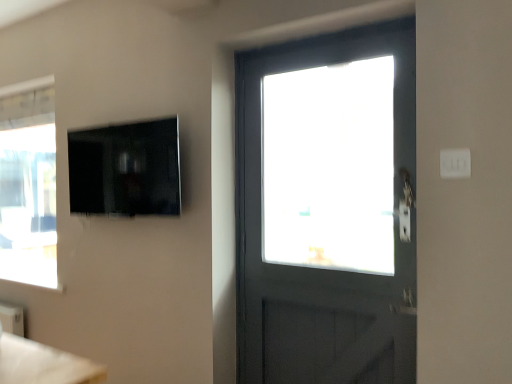
Question: Is matte black tv at upper left at the back of white plastic light switch at upper right?

Choices:
 (A) no
 (B) yes

Answer: (A)

Question: Can you confirm if white plastic light switch at upper right is smaller than matte black tv at upper left?

Choices:
 (A) no
 (B) yes

Answer: (B)

Question: Would you say white plastic light switch at upper right is outside matte black tv at upper left?

Choices:
 (A) yes
 (B) no

Answer: (A)

Question: From the image's perspective, is white plastic light switch at upper right on matte black tv at upper left?

Choices:
 (A) yes
 (B) no

Answer: (B)

Question: Would you say matte black tv at upper left is part of white plastic light switch at upper right's contents?

Choices:
 (A) no
 (B) yes

Answer: (A)

Question: Are white plastic light switch at upper right and matte black tv at upper left making contact?

Choices:
 (A) yes
 (B) no

Answer: (B)

Question: Can you confirm if matte black tv at upper left is shorter than white plastic light switch at upper right?

Choices:
 (A) yes
 (B) no

Answer: (B)

Question: Is matte black tv at upper left outside of white plastic light switch at upper right?

Choices:
 (A) yes
 (B) no

Answer: (A)

Question: Is matte black tv at upper left positioned with its back to white plastic light switch at upper right?

Choices:
 (A) yes
 (B) no

Answer: (B)

Question: Can you see matte black tv at upper left touching white plastic light switch at upper right?

Choices:
 (A) yes
 (B) no

Answer: (B)

Question: Considering the relative sizes of matte black tv at upper left and white plastic light switch at upper right in the image provided, is matte black tv at upper left taller than white plastic light switch at upper right?

Choices:
 (A) yes
 (B) no

Answer: (A)

Question: Can you confirm if matte black tv at upper left is positioned to the right of white plastic light switch at upper right?

Choices:
 (A) yes
 (B) no

Answer: (B)

Question: Based on their positions, is matte black tv at upper left located to the left or right of white plastic light switch at upper right?

Choices:
 (A) left
 (B) right

Answer: (A)